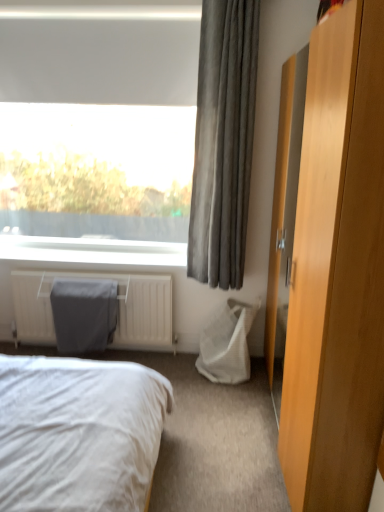
Question: Is point (332, 382) positioned closer to the camera than point (253, 48)?

Choices:
 (A) farther
 (B) closer

Answer: (B)

Question: Relative to gray fabric curtain at upper right, is light brown wood dresser at right in front or behind?

Choices:
 (A) front
 (B) behind

Answer: (A)

Question: Based on their relative distances, which object is nearer to the light brown wood dresser at right?

Choices:
 (A) matte fabric radiator cover at lower left
 (B) gray fabric curtain at upper right
 (C) white fabric bed at lower left

Answer: (C)

Question: Estimate the real-world distances between objects in this image. Which object is farther from the matte fabric radiator cover at lower left?

Choices:
 (A) gray fabric curtain at upper right
 (B) white fabric bed at lower left
 (C) light brown wood dresser at right

Answer: (C)